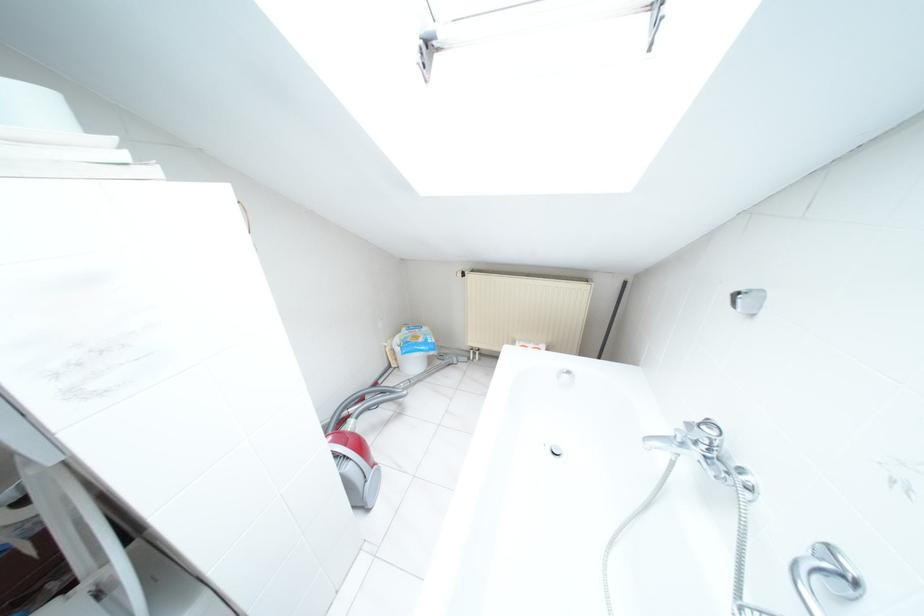
The width and height of the screenshot is (924, 616). In order to click on skylight handle in this screenshot , I will do `click(424, 62)`.